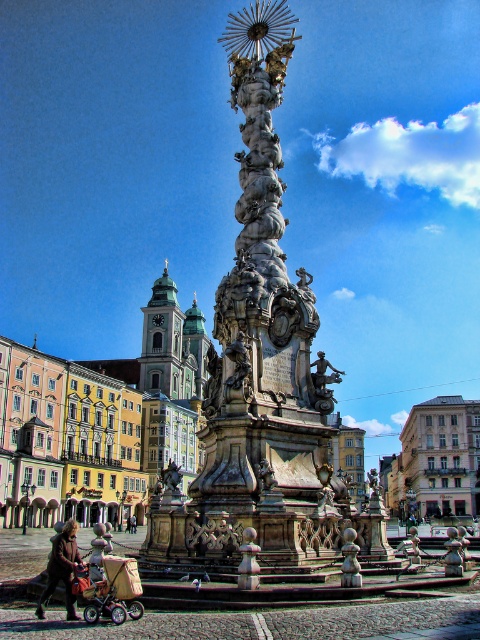
Question: Is the position of brown leather coat at lower left less distant than that of light brown wooden baby carriage at lower center?

Choices:
 (A) no
 (B) yes

Answer: (B)

Question: Is metallic silver baby carriage at lower left bigger than brown leather coat at lower left?

Choices:
 (A) yes
 (B) no

Answer: (B)

Question: Can you confirm if light brown wooden baby carriage at lower center is wider than bronze statue at center?

Choices:
 (A) yes
 (B) no

Answer: (A)

Question: Which of these objects is positioned closest to the green stone tower at center?

Choices:
 (A) light brown leather jacket at lower center
 (B) brown leather coat at lower left

Answer: (A)

Question: Which point is closer to the camera taking this photo?

Choices:
 (A) (134, 516)
 (B) (315, 358)

Answer: (B)

Question: Which object is the farthest from the light brown leather jacket at lower center?

Choices:
 (A) polished stone column at center
 (B) brown leather coat at lower left
 (C) bronze statue at center
 (D) light brown wooden baby carriage at lower center

Answer: (B)